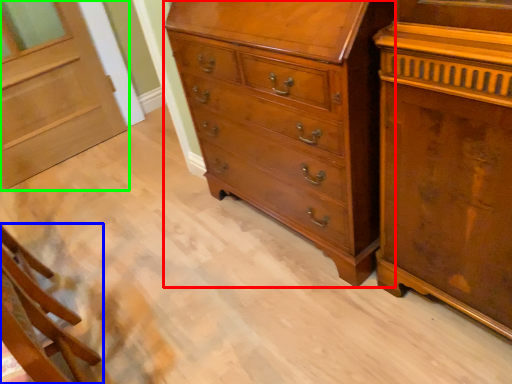
Question: Which is nearer to the chest of drawers (highlighted by a red box)? furniture (highlighted by a blue box) or door (highlighted by a green box).

Choices:
 (A) furniture
 (B) door

Answer: (A)